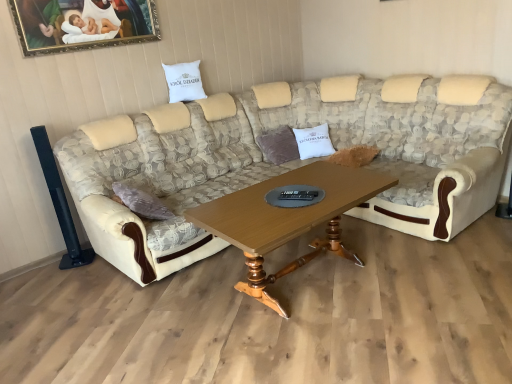
The height and width of the screenshot is (384, 512). In order to click on free location above woodenwoodencoffee table at center (from a real-world perspective) in this screenshot , I will do `click(293, 200)`.